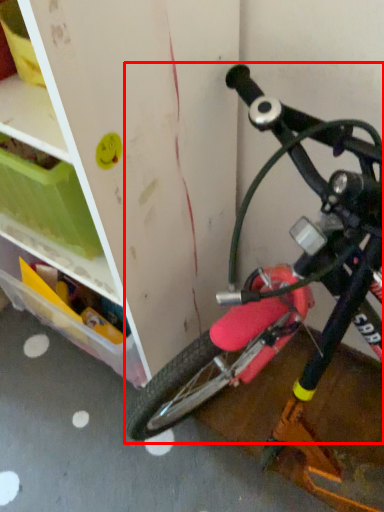
Question: From the image's perspective, what is the correct spatial positioning of bicycle (annotated by the red box) in reference to storage box?

Choices:
 (A) above
 (B) below

Answer: (B)